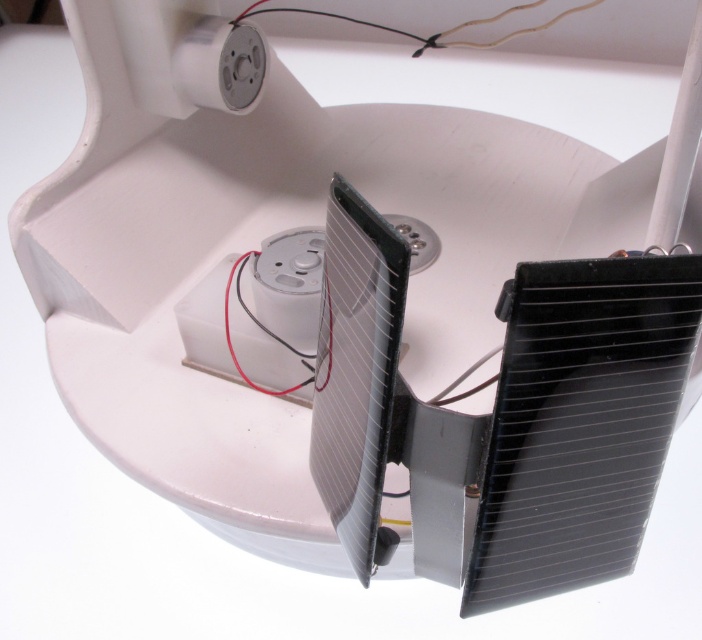
Based on the photo, can you confirm if metallic silver plug at upper center is shorter than black plastic wire at center?

Correct, metallic silver plug at upper center is not as tall as black plastic wire at center.

Who is more distant from viewer, (227,56) or (244,260)?

Point (227,56)

What do you see at coordinates (220, 65) in the screenshot?
I see `metallic silver plug at upper center` at bounding box center [220, 65].

Identify the location of metallic silver plug at upper center. The height and width of the screenshot is (640, 702). (220, 65).